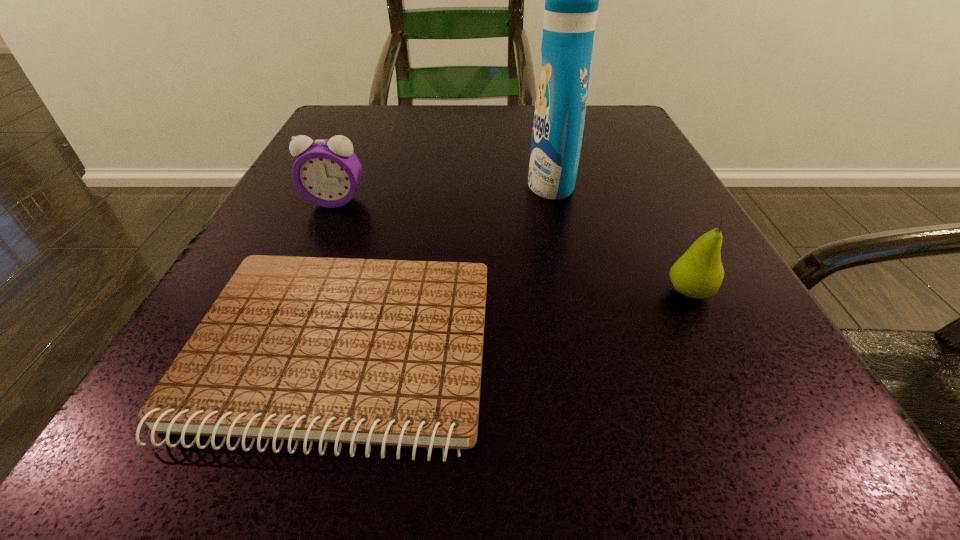
Find the location of a particular element. unoccupied position between the detergent and the alarm clock is located at coordinates coord(443,193).

Identify which object is the third closest to the notebook. Please provide its 2D coordinates. Your answer should be formatted as a tuple, i.e. [(x, y)], where the tuple contains the x and y coordinates of a point satisfying the conditions above.

[(698, 273)]

You are a GUI agent. You are given a task and a screenshot of the screen. Output one action in this format:
    pyautogui.click(x=<x>, y=<y>)
    Task: Click on the object that ranks as the closest to the rightmost object
    The width and height of the screenshot is (960, 540).
    Given the screenshot: What is the action you would take?
    pyautogui.click(x=571, y=0)

Identify the location of vacant region that satisfies the following two spatial constraints: 1. on the front-facing side of the tallest object; 2. on the front side of the shortest object. (589, 352).

I want to click on vacant area in the image that satisfies the following two spatial constraints: 1. on the back side of the rightmost object; 2. on the front-facing side of the detergent, so click(635, 184).

Locate an element on the screen. The image size is (960, 540). blank area in the image that satisfies the following two spatial constraints: 1. on the front-facing side of the rightmost object; 2. on the left side of the tallest object is located at coordinates (576, 292).

You are a GUI agent. You are given a task and a screenshot of the screen. Output one action in this format:
    pyautogui.click(x=<x>, y=<y>)
    Task: Click on the vacant space that satisfies the following two spatial constraints: 1. on the front-facing side of the tallest object; 2. on the left side of the pear
    
    Given the screenshot: What is the action you would take?
    pyautogui.click(x=576, y=292)

Where is `vacant space that satisfies the following two spatial constraints: 1. on the back side of the pear; 2. on the front-facing side of the detergent`? The height and width of the screenshot is (540, 960). vacant space that satisfies the following two spatial constraints: 1. on the back side of the pear; 2. on the front-facing side of the detergent is located at coordinates (635, 184).

Where is `free space that satisfies the following two spatial constraints: 1. on the front-facing side of the second object from right to left; 2. on the back side of the rightmost object`? free space that satisfies the following two spatial constraints: 1. on the front-facing side of the second object from right to left; 2. on the back side of the rightmost object is located at coordinates (576, 292).